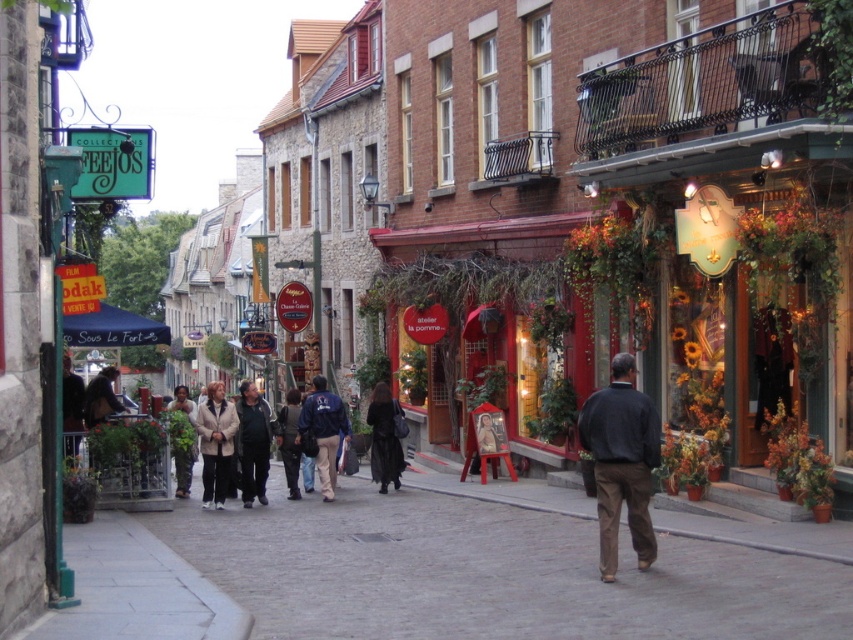
You are a tailor observing a light beige coat at center and a dark blue jacket at center in the image. Which garment has a shorter length?

The light beige coat at center is shorter than the dark blue jacket at center.

You are a tailor who needs to determine which garment to alter first. You see a dark gray sweater at center and a dark gray jacket at center. Which garment has a wider width?

The dark gray sweater at center has a larger width than the dark gray jacket at center.